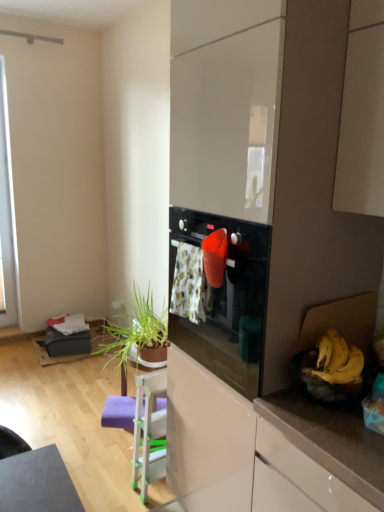
This screenshot has width=384, height=512. I want to click on white plastic chair at lower center, so pos(149,431).

In order to face green leafy plant at lower left, should I rotate leftwards or rightwards?

To align with it, rotate left about 7.489°.

I want to click on green leafy plant at lower left, so click(139, 334).

The height and width of the screenshot is (512, 384). What do you see at coordinates (259, 241) in the screenshot?
I see `glossy white dresser at center` at bounding box center [259, 241].

The width and height of the screenshot is (384, 512). Describe the element at coordinates (189, 284) in the screenshot. I see `floral fabric laundry at center` at that location.

Find the location of a particular element. The height and width of the screenshot is (512, 384). white plastic chair at lower center is located at coordinates (149, 431).

Which object is further away from the camera, yellow matte bananas at right or white plastic chair at lower center?

white plastic chair at lower center is further from the camera.

Can you confirm if yellow matte bananas at right is shorter than white plastic chair at lower center?

Correct, yellow matte bananas at right is not as tall as white plastic chair at lower center.

How many degrees apart are the facing directions of floral fabric laundry at center and white plastic chair at lower center?

0.0038 degrees.

Does floral fabric laundry at center have a smaller size compared to white plastic chair at lower center?

Yes.

Considering the positions of objects floral fabric laundry at center and white plastic chair at lower center in the image provided, who is behind, floral fabric laundry at center or white plastic chair at lower center?

white plastic chair at lower center is further from the camera.

Is floral fabric laundry at center shorter than white plastic chair at lower center?

Indeed, floral fabric laundry at center has a lesser height compared to white plastic chair at lower center.

What's the angular difference between glossy white dresser at center and yellow matte bananas at right's facing directions?

The facing directions of glossy white dresser at center and yellow matte bananas at right are 0.689 degrees apart.

From the picture: Is glossy white dresser at center oriented away from yellow matte bananas at right?

That's not correct — glossy white dresser at center is not looking away from yellow matte bananas at right.

Is glossy white dresser at center far from yellow matte bananas at right?

They are positioned close to each other.

Considering the relative sizes of glossy white dresser at center and yellow matte bananas at right in the image provided, is glossy white dresser at center smaller than yellow matte bananas at right?

No, glossy white dresser at center is not smaller than yellow matte bananas at right.

Can you confirm if floral fabric laundry at center is bigger than yellow matte bananas at right?

Indeed, floral fabric laundry at center has a larger size compared to yellow matte bananas at right.

Considering the relative sizes of floral fabric laundry at center and yellow matte bananas at right in the image provided, is floral fabric laundry at center shorter than yellow matte bananas at right?

Incorrect, the height of floral fabric laundry at center does not fall short of that of yellow matte bananas at right.

Considering the relative sizes of floral fabric laundry at center and yellow matte bananas at right in the image provided, is floral fabric laundry at center thinner than yellow matte bananas at right?

Correct, the width of floral fabric laundry at center is less than that of yellow matte bananas at right.

Does point (201, 256) appear closer or farther from the camera than point (349, 356)?

Point (201, 256) appears to be farther away from the viewer than point (349, 356).

Between point (143, 499) and point (139, 341), which one is positioned behind?

Point (139, 341)

In terms of width, does white plastic chair at lower center look wider or thinner when compared to green leafy plant at lower left?

white plastic chair at lower center is thinner than green leafy plant at lower left.

Considering the relative sizes of white plastic chair at lower center and green leafy plant at lower left in the image provided, is white plastic chair at lower center shorter than green leafy plant at lower left?

In fact, white plastic chair at lower center may be taller than green leafy plant at lower left.

From the image's perspective, is white plastic chair at lower center above green leafy plant at lower left?

No.

From the image's perspective, which one is positioned higher, green leafy plant at lower left or yellow matte bananas at right?

yellow matte bananas at right.

How distant is green leafy plant at lower left from yellow matte bananas at right?

green leafy plant at lower left is 3.36 feet away from yellow matte bananas at right.

Locate an element on the screen. This screenshot has width=384, height=512. houseplant behind the yellow matte bananas at right is located at coordinates (139, 334).

Can you confirm if green leafy plant at lower left is shorter than yellow matte bananas at right?

In fact, green leafy plant at lower left may be taller than yellow matte bananas at right.

Can you tell me how much glossy white dresser at center and green leafy plant at lower left differ in facing direction?

0.476 degrees.

Is glossy white dresser at center inside or outside of green leafy plant at lower left?

glossy white dresser at center exists outside the volume of green leafy plant at lower left.

Between glossy white dresser at center and green leafy plant at lower left, which one is positioned behind?

green leafy plant at lower left.

Which is in front, point (197, 206) or point (148, 359)?

The point (197, 206) is more forward.

Find the location of `banana located above the white plastic chair at lower center (from a real-world perspective)`. banana located above the white plastic chair at lower center (from a real-world perspective) is located at coordinates (338, 360).

Image resolution: width=384 pixels, height=512 pixels. In order to click on chair on the left of floral fabric laundry at center in this screenshot , I will do `click(149, 431)`.

From the image, which object appears to be nearer to floral fabric laundry at center, green leafy plant at lower left or glossy white dresser at center?

glossy white dresser at center is closer to floral fabric laundry at center.

Which object lies further to the anchor point white plastic chair at lower center, yellow matte bananas at right or green leafy plant at lower left?

yellow matte bananas at right.

Based on the photo, estimate the real-world distances between objects in this image. Which object is further from yellow matte bananas at right, green leafy plant at lower left or white plastic chair at lower center?

green leafy plant at lower left lies further to yellow matte bananas at right than the other object.

Based on their spatial positions, is floral fabric laundry at center or green leafy plant at lower left further from white plastic chair at lower center?

Among the two, floral fabric laundry at center is located further to white plastic chair at lower center.

When comparing their distances from glossy white dresser at center, does white plastic chair at lower center or floral fabric laundry at center seem closer?

floral fabric laundry at center is positioned closer to the anchor glossy white dresser at center.

Estimate the real-world distances between objects in this image. Which object is closer to white plastic chair at lower center, glossy white dresser at center or yellow matte bananas at right?

The object closer to white plastic chair at lower center is glossy white dresser at center.

Considering their positions, is green leafy plant at lower left positioned closer to white plastic chair at lower center than yellow matte bananas at right?

green leafy plant at lower left.

Estimate the real-world distances between objects in this image. Which object is further from yellow matte bananas at right, glossy white dresser at center or green leafy plant at lower left?

Among the two, green leafy plant at lower left is located further to yellow matte bananas at right.

Where is `laundry located between glossy white dresser at center and green leafy plant at lower left in the depth direction`? laundry located between glossy white dresser at center and green leafy plant at lower left in the depth direction is located at coordinates (189, 284).

Where is `banana located between glossy white dresser at center and white plastic chair at lower center in the depth direction`? Image resolution: width=384 pixels, height=512 pixels. banana located between glossy white dresser at center and white plastic chair at lower center in the depth direction is located at coordinates (338, 360).

Locate an element on the screen. This screenshot has height=512, width=384. banana located between glossy white dresser at center and green leafy plant at lower left in the depth direction is located at coordinates (338, 360).

At what (x,y) coordinates should I click in order to perform the action: click on houseplant between glossy white dresser at center and white plastic chair at lower center from front to back. Please return your answer as a coordinate pair (x, y). Looking at the image, I should click on (139, 334).